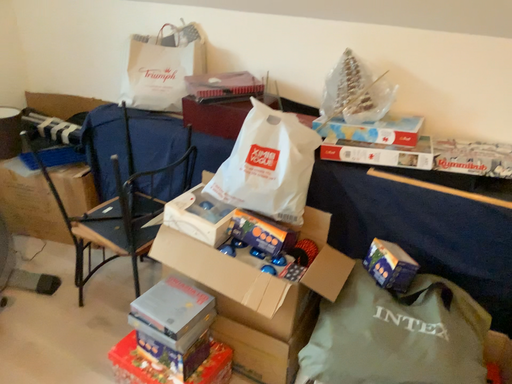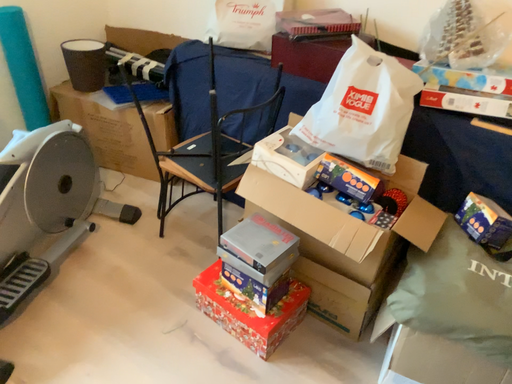
Question: Which way did the camera rotate in the video?

Choices:
 (A) rotated upward
 (B) rotated downward

Answer: (B)